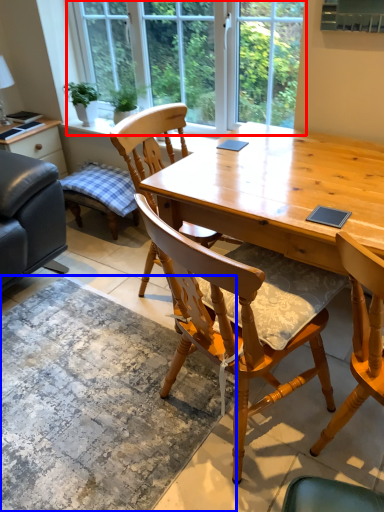
Question: Which of the following is the closest to the observer, window (highlighted by a red box) or mat (highlighted by a blue box)?

Choices:
 (A) window
 (B) mat

Answer: (B)